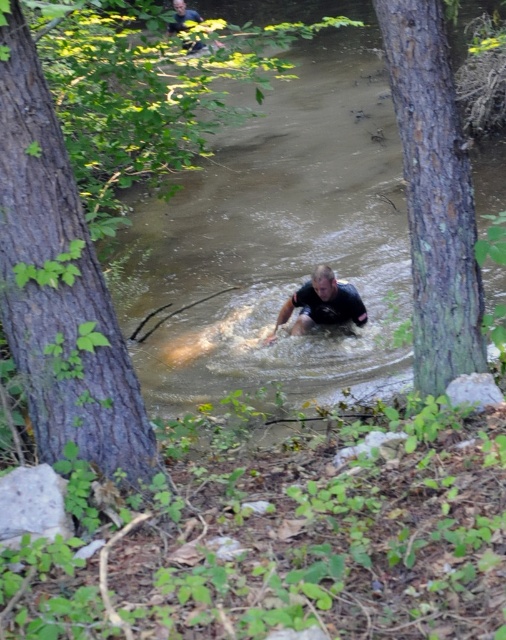
Is brown rough tree trunk at center-left above green rough bark tree at center?

No.

Is brown rough tree trunk at center-left shorter than green rough bark tree at center?

No.

Who is more distant from viewer, (51, 250) or (441, 202)?

Point (441, 202)

Locate an element on the screen. The height and width of the screenshot is (640, 506). brown rough tree trunk at center-left is located at coordinates (60, 285).

Can you confirm if brown rough tree trunk at center-left is wider than black matte shirt at center?

Incorrect, brown rough tree trunk at center-left's width does not surpass black matte shirt at center's.

Does point (16, 42) lie behind point (289, 296)?

No, (16, 42) is closer to viewer.

Is point (105, 412) positioned after point (331, 317)?

No, (105, 412) is closer to viewer.

Find the location of a particular element. This screenshot has height=640, width=506. brown rough tree trunk at center-left is located at coordinates (60, 285).

Is point (442, 19) in front of point (336, 298)?

Yes, point (442, 19) is closer to viewer.

Who is positioned more to the right, green rough bark tree at center or black matte shirt at center?

green rough bark tree at center is more to the right.

I want to click on green rough bark tree at center, so click(x=435, y=195).

You are a GUI agent. You are given a task and a screenshot of the screen. Output one action in this format:
    pyautogui.click(x=<x>, y=<y>)
    Task: Click on the green rough bark tree at center
    
    Given the screenshot: What is the action you would take?
    pyautogui.click(x=435, y=195)